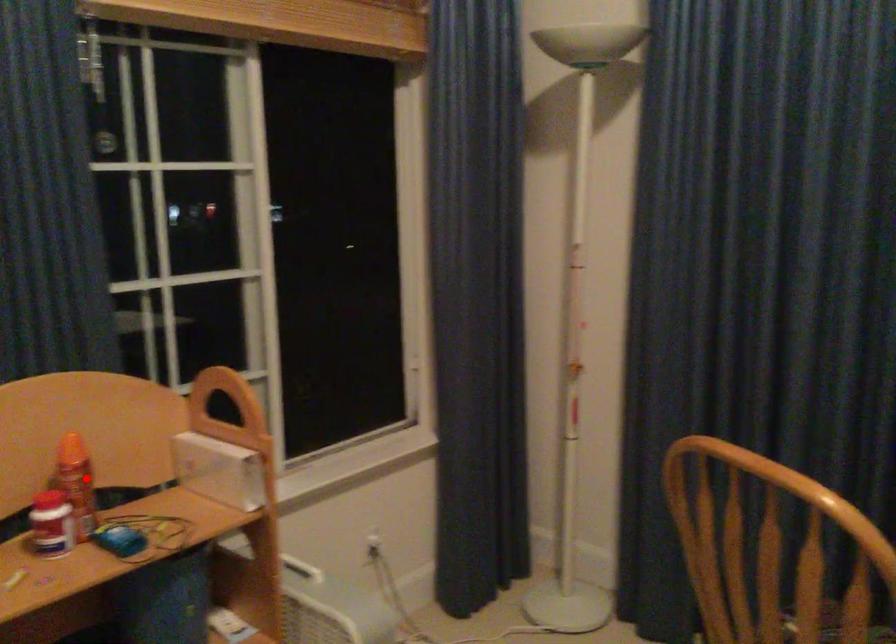
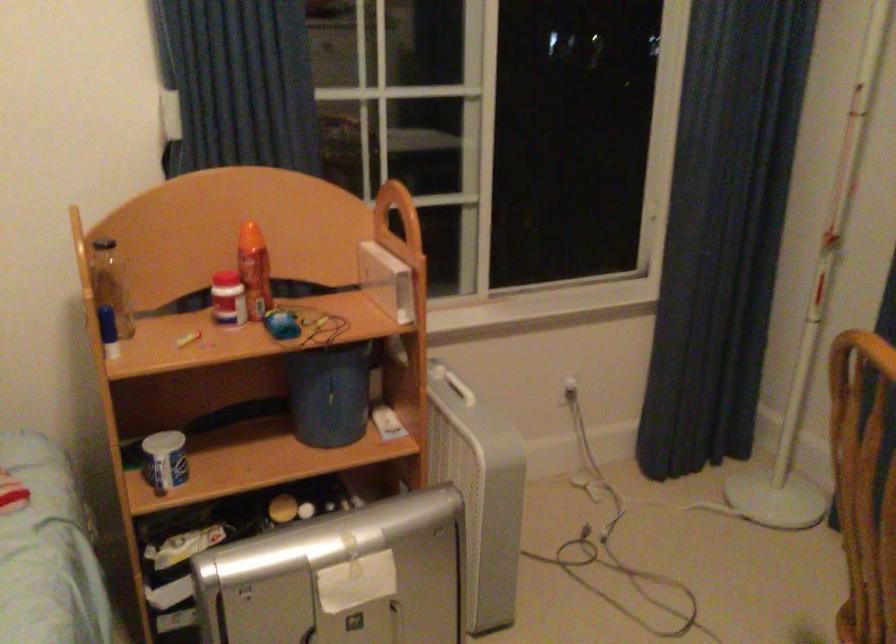
Where in the second image is the point corresponding to the highlighted location from the first image?

(254, 270)